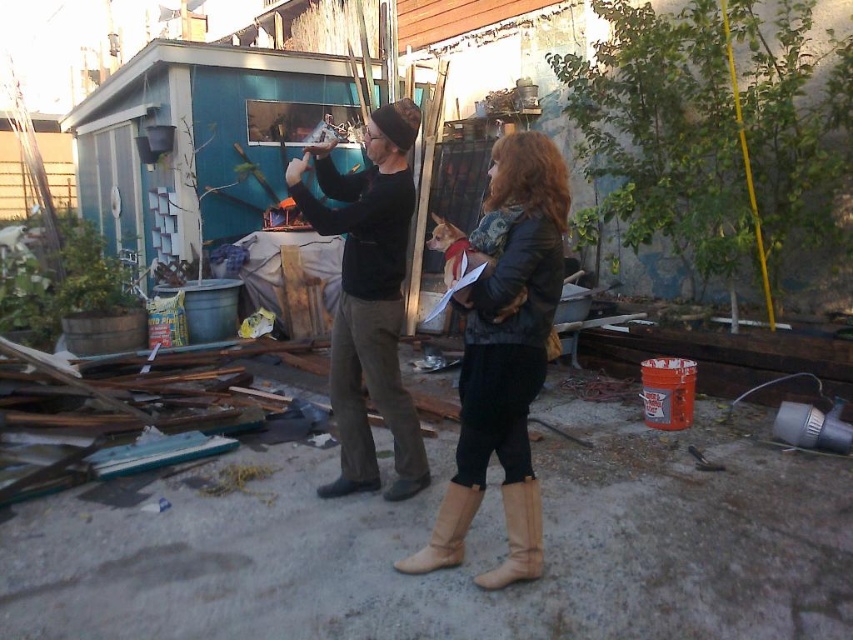
The height and width of the screenshot is (640, 853). What do you see at coordinates (503, 353) in the screenshot? I see `leather boots at center` at bounding box center [503, 353].

Is leather boots at center shorter than black matte pants at center?

Correct, leather boots at center is not as tall as black matte pants at center.

Does point (479, 484) come farther from viewer compared to point (397, 200)?

No, (479, 484) is in front of (397, 200).

Where is `leather boots at center`? The image size is (853, 640). leather boots at center is located at coordinates (503, 353).

Who is positioned more to the right, black matte pants at center or tan suede boot at lower center?

Positioned to the right is tan suede boot at lower center.

Locate an element on the screen. black matte pants at center is located at coordinates (368, 298).

Can you confirm if leather boots at center is wider than tan suede boots at center?

Correct, the width of leather boots at center exceeds that of tan suede boots at center.

Does point (534, 346) lie behind point (465, 486)?

No, it is not.

The image size is (853, 640). I want to click on leather boots at center, so click(503, 353).